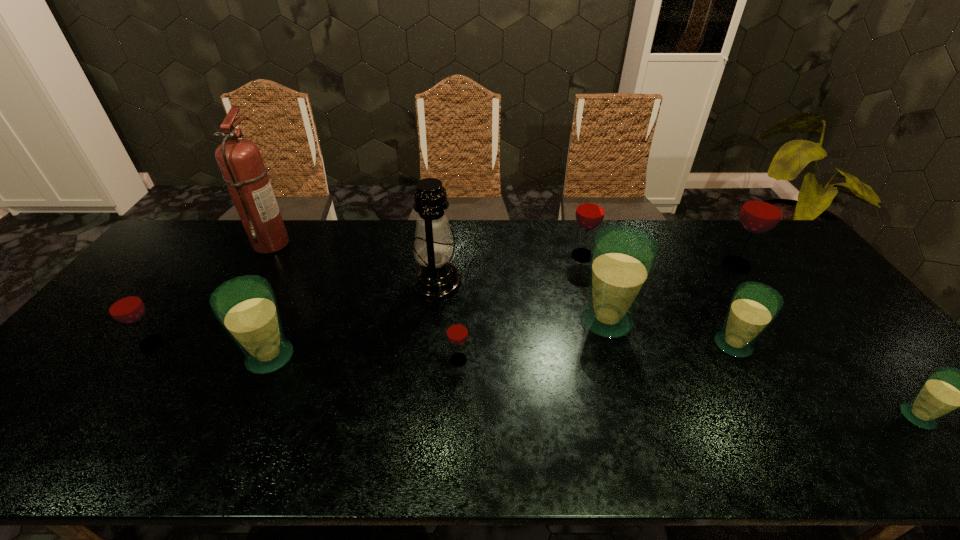
Where is `free space located on the right of the ninth object from left to right`? This screenshot has height=540, width=960. free space located on the right of the ninth object from left to right is located at coordinates (793, 265).

At what (x,y) coordinates should I click in order to perform the action: click on free space located on the back of the second blue glass from left to right. Please return your answer as a coordinate pair (x, y). Image resolution: width=960 pixels, height=540 pixels. Looking at the image, I should click on (596, 287).

Locate an element on the screen. The image size is (960, 540). vacant region located on the left of the second biggest red glass is located at coordinates (499, 255).

Where is `vacant space situated 0.110m on the front of the second glass from left to right`? vacant space situated 0.110m on the front of the second glass from left to right is located at coordinates (243, 418).

Find the location of a particular element. The height and width of the screenshot is (540, 960). vacant area situated 0.260m on the back of the leftmost object is located at coordinates (204, 272).

This screenshot has height=540, width=960. Find the location of `vacant area situated on the front of the second smallest blue glass`. vacant area situated on the front of the second smallest blue glass is located at coordinates (766, 406).

Image resolution: width=960 pixels, height=540 pixels. I want to click on free region located on the front of the smallest red glass, so click(454, 451).

I want to click on free space located on the back of the smallest blue glass, so click(x=847, y=332).

Locate an element on the screen. fire extinguisher positioned at the far edge is located at coordinates (240, 161).

I want to click on object positioned at the near edge, so point(946,389).